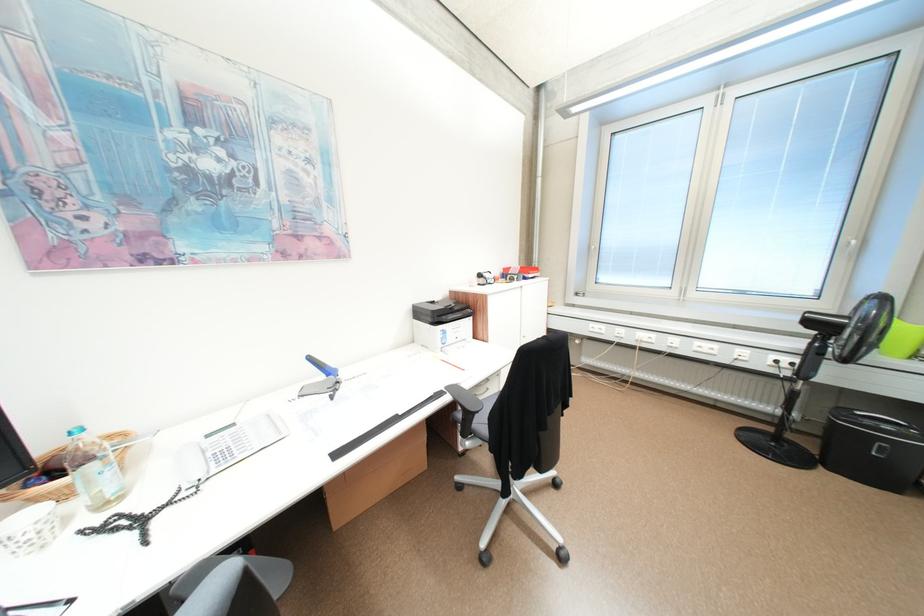
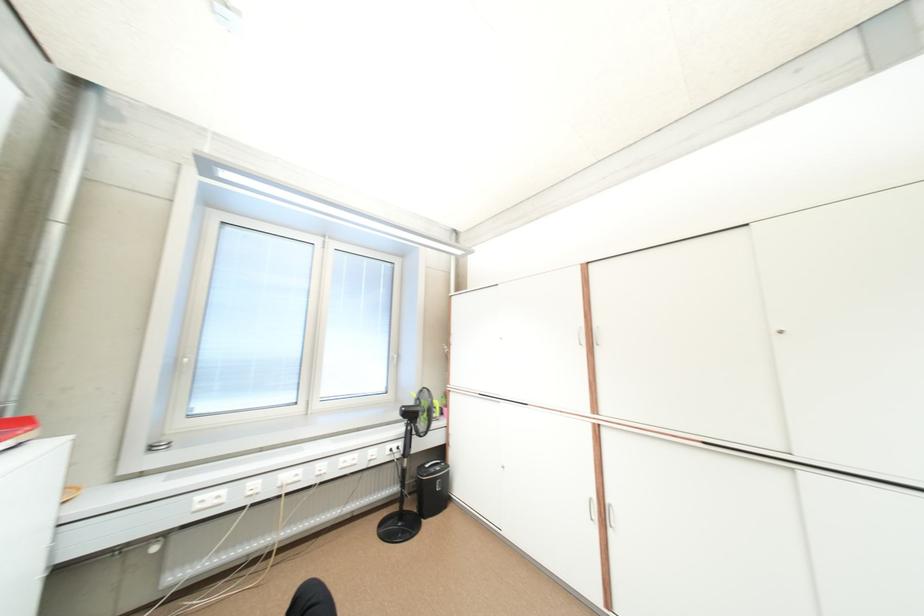
Question: Based on the continuous images, in which direction is the camera rotating? Reply with the corresponding letter.

Choices:
 (A) Left
 (B) Right
 (C) Up
 (D) Down

Answer: (B)